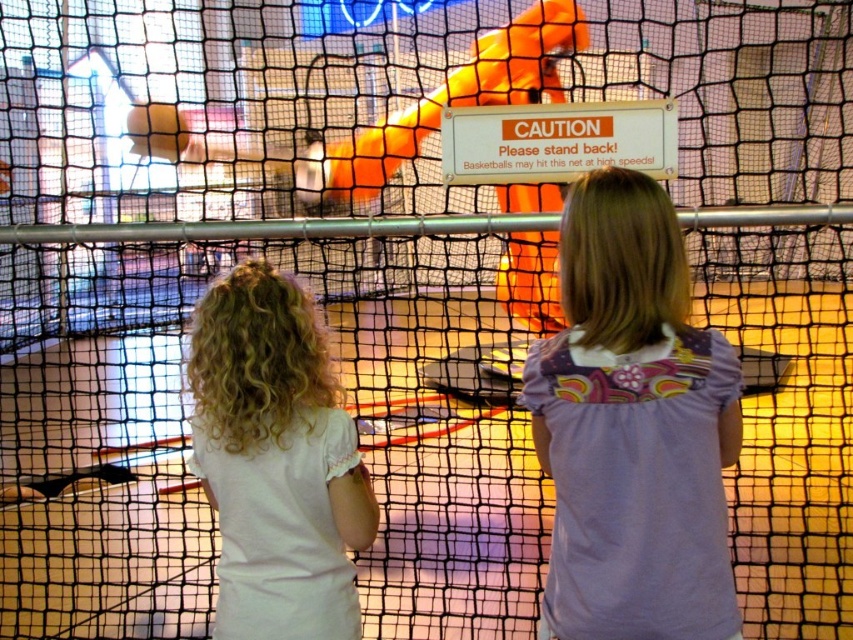
Who is positioned more to the right, purple floral shirt at center or white cotton shirt at center?

From the viewer's perspective, purple floral shirt at center appears more on the right side.

Does purple floral shirt at center appear on the left side of white cotton shirt at center?

No, purple floral shirt at center is not to the left of white cotton shirt at center.

Between point (561, 470) and point (238, 570), which one is positioned in front?

Point (561, 470)

Where is `purple floral shirt at center`? The width and height of the screenshot is (853, 640). purple floral shirt at center is located at coordinates (633, 428).